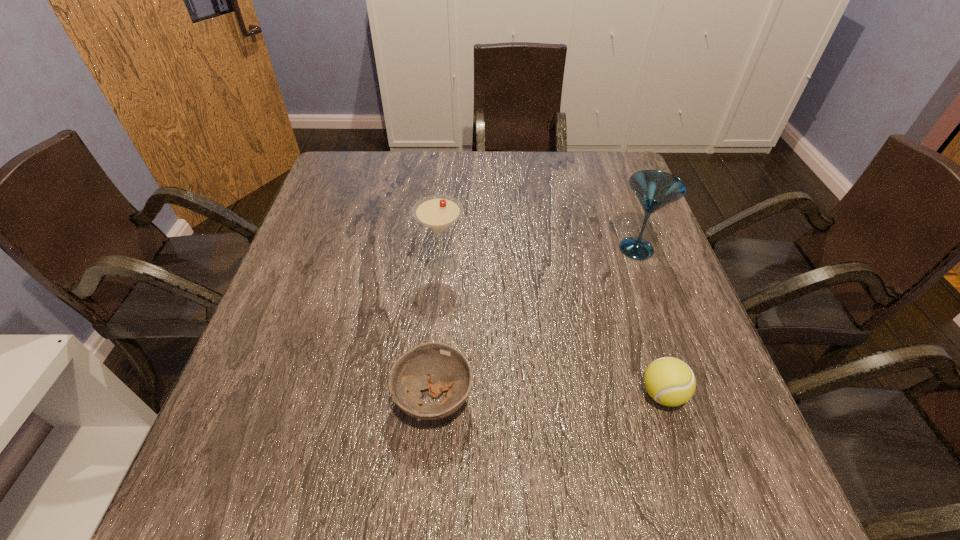
The image size is (960, 540). I want to click on the right martini, so click(654, 189).

You are a GUI agent. You are given a task and a screenshot of the screen. Output one action in this format:
    pyautogui.click(x=<x>, y=<y>)
    Task: Click on the left martini
    
    Given the screenshot: What is the action you would take?
    pyautogui.click(x=438, y=213)

Locate an element on the screen. The width and height of the screenshot is (960, 540). tennis ball is located at coordinates (669, 381).

I want to click on the shortest object, so click(438, 367).

Locate an element on the screen. free spot located 0.180m on the front of the right martini is located at coordinates (664, 325).

You are a GUI agent. You are given a task and a screenshot of the screen. Output one action in this format:
    pyautogui.click(x=<x>, y=<y>)
    Task: Click on the vacant space located on the left of the left martini
    The width and height of the screenshot is (960, 540).
    Given the screenshot: What is the action you would take?
    pyautogui.click(x=295, y=266)

This screenshot has height=540, width=960. In order to click on blank space located 0.390m on the left of the second shortest object in this screenshot , I will do `click(431, 394)`.

Locate an element on the screen. blank area located 0.130m on the front of the shortest object is located at coordinates (424, 517).

Where is `martini present at the right edge`? The height and width of the screenshot is (540, 960). martini present at the right edge is located at coordinates (654, 189).

Locate an element on the screen. The height and width of the screenshot is (540, 960). tennis ball that is at the right edge is located at coordinates (669, 381).